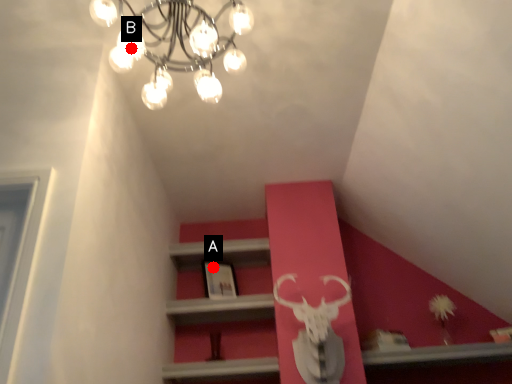
Question: Two points are circled on the image, labeled by A and B beside each circle. Which point appears farthest from the camera in this image?

Choices:
 (A) A is further
 (B) B is further

Answer: (A)